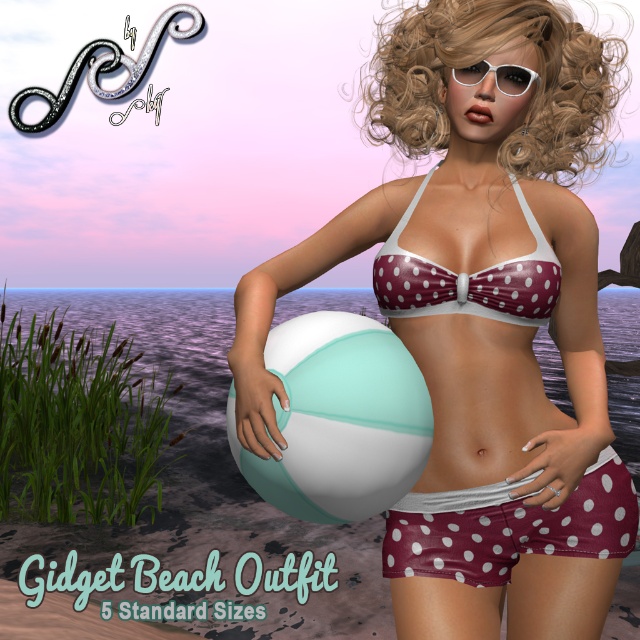
Can you confirm if blonde curly hair at upper center is positioned to the left of maroon satin shorts at lower center?

Incorrect, blonde curly hair at upper center is not on the left side of maroon satin shorts at lower center.

Who is more distant from viewer, (x=449, y=122) or (x=472, y=488)?

The point (x=449, y=122) is behind.

Identify the location of blonde curly hair at upper center. (483, 58).

Is point (534, 412) farther from camera compared to point (532, 275)?

Yes, it is.

Who is positioned more to the right, maroon polka dot bikini at center or maroon polka dot bikini top at center?

From the viewer's perspective, maroon polka dot bikini at center appears more on the right side.

What do you see at coordinates (481, 317) in the screenshot? I see `maroon polka dot bikini at center` at bounding box center [481, 317].

I want to click on maroon polka dot bikini at center, so click(481, 317).

Locate an element on the screen. Image resolution: width=640 pixels, height=640 pixels. maroon satin shorts at lower center is located at coordinates (509, 528).

Which is above, maroon satin shorts at lower center or white matte glasses at upper center?

white matte glasses at upper center is higher up.

Locate an element on the screen. maroon satin shorts at lower center is located at coordinates pyautogui.click(x=509, y=528).